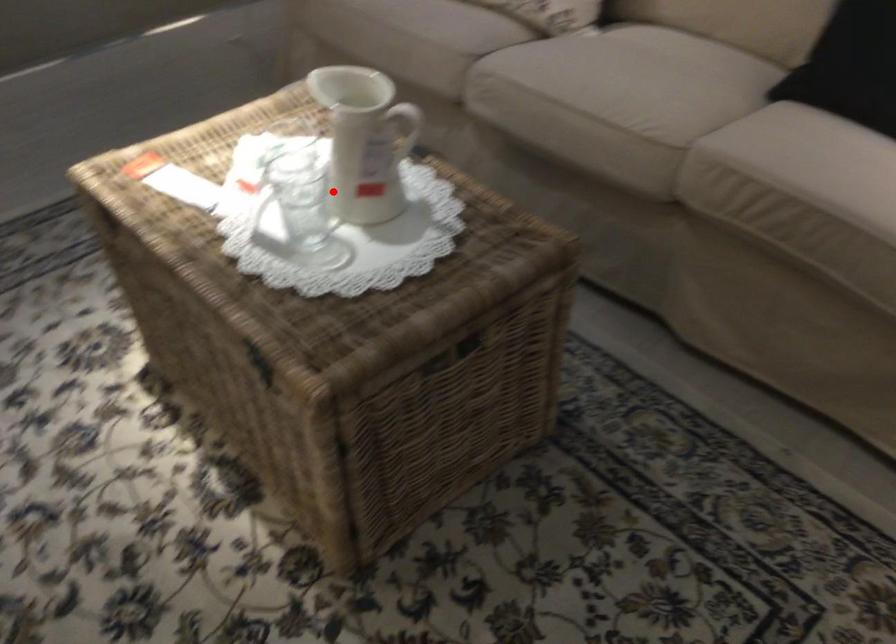
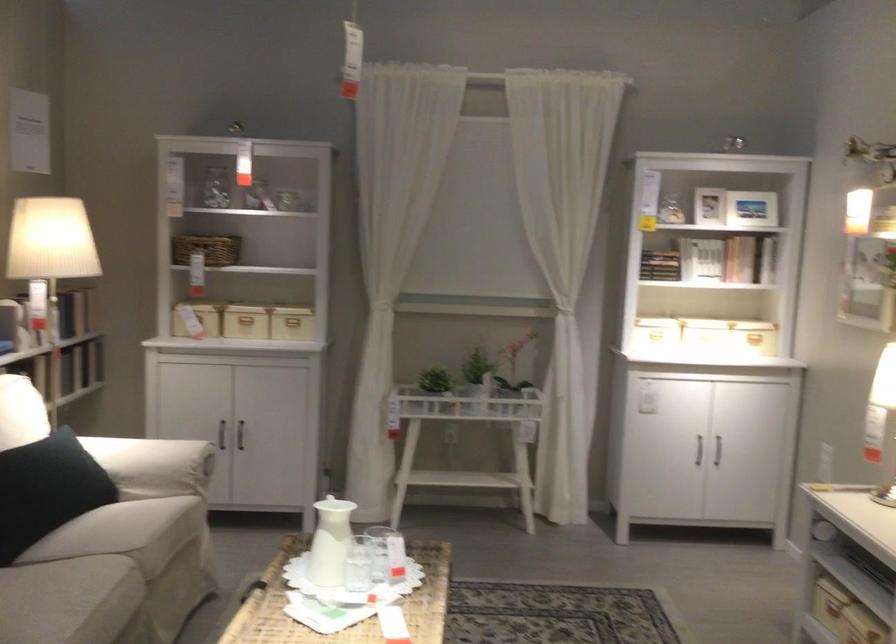
Question: I am providing you with two images of the same scene from different viewpoints. In image1, a red point is highlighted. Considering the same 3D point in image2, which of the following is correct?

Choices:
 (A) It is closer
 (B) It is farther

Answer: (B)